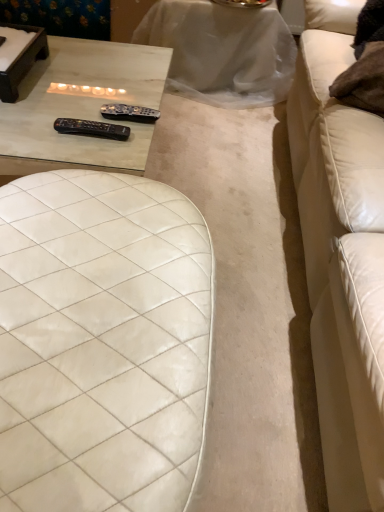
Find the location of a particular element. Image resolution: width=384 pixels, height=512 pixels. vacant space behind black plastic remote at center, which appears as the 2th remote when viewed from the back is located at coordinates (85, 110).